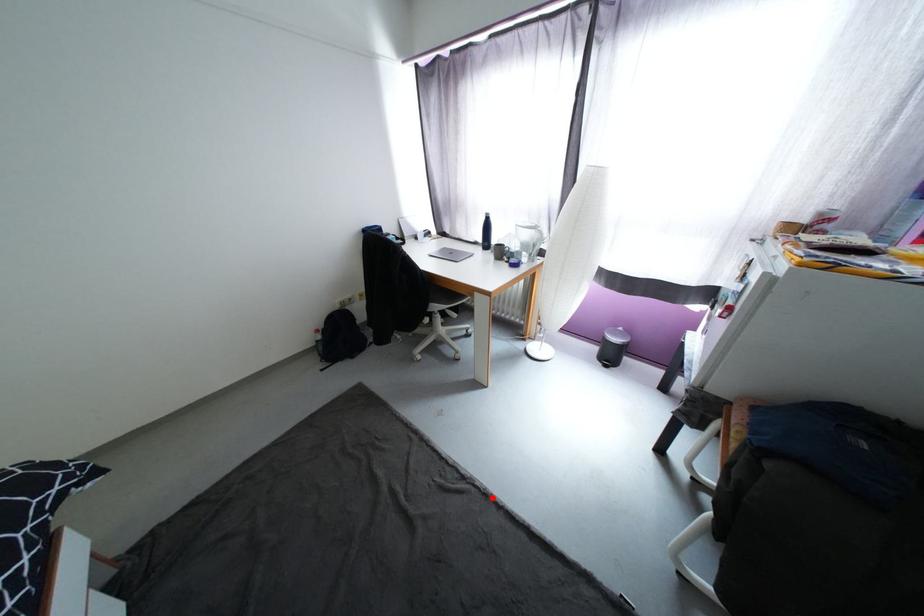
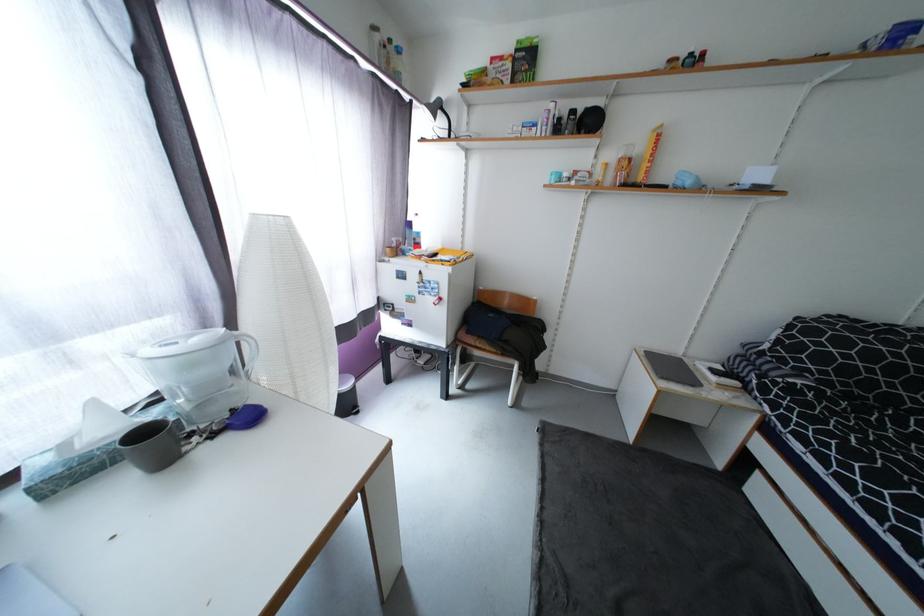
Find the pixel in the second image that matches the highlighted location in the first image.

(548, 524)